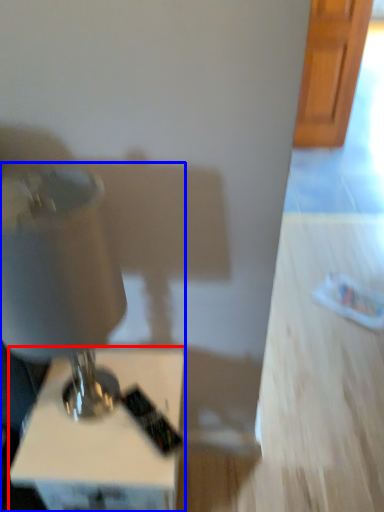
Question: Among these objects, which one is nearest to the camera, furniture (highlighted by a red box) or sewing machine (highlighted by a blue box)?

Choices:
 (A) furniture
 (B) sewing machine

Answer: (B)